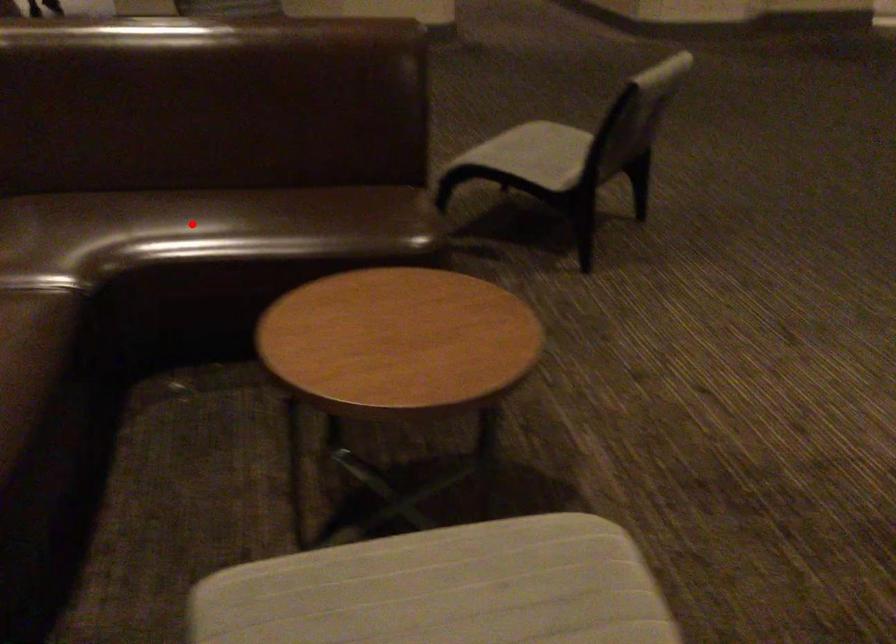
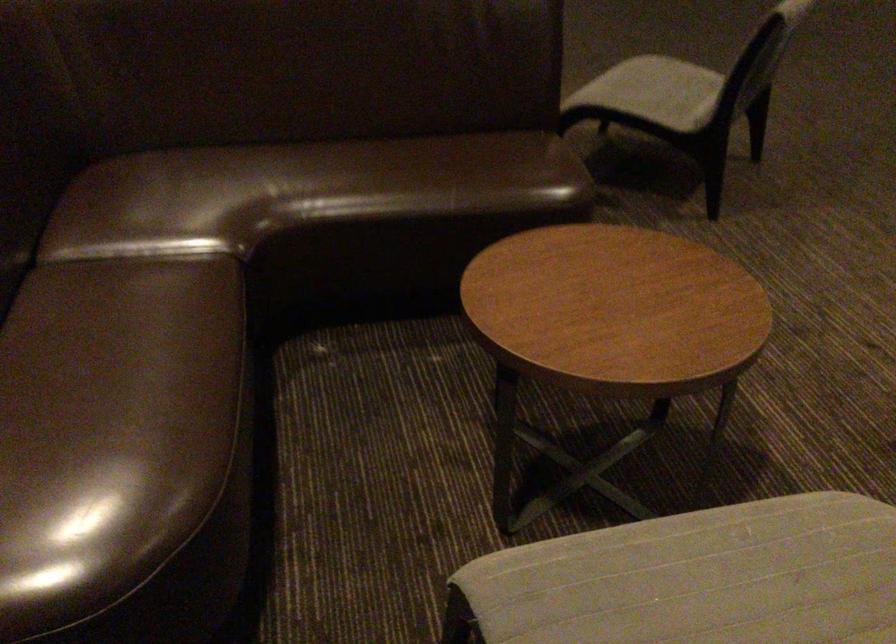
Where in the second image is the point corresponding to the highlighted location from the first image?

(334, 180)